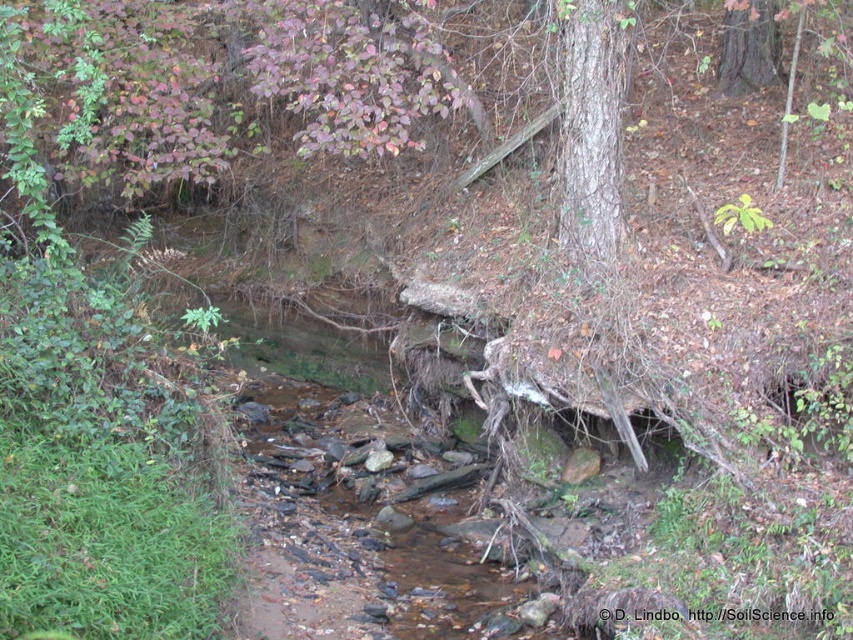
You are standing at the point labeled as point (590, 132) in the image. What type of surface are you currently standing on?

You are standing on smooth bark tree at center.

You are a hiker trying to cross the stream. You see the smooth bark tree at center and the smooth brown tree trunk at upper right. Which one is closer to the left side of the stream?

Answer: The smooth bark tree at center is positioned on the left side of the smooth brown tree trunk at upper right, so it is closer to the left side of the stream.

You are a hiker trying to cross the stream. You notice two trees nearby. The smooth bark tree at center and the smooth brown tree trunk at upper right. Which tree is taller?

The smooth bark tree at center is taller than the smooth brown tree trunk at upper right.